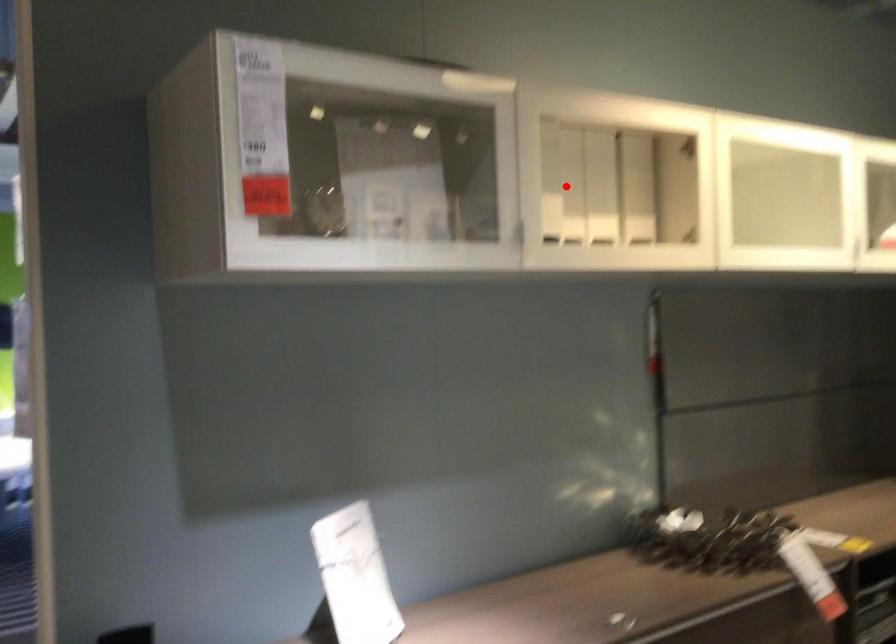
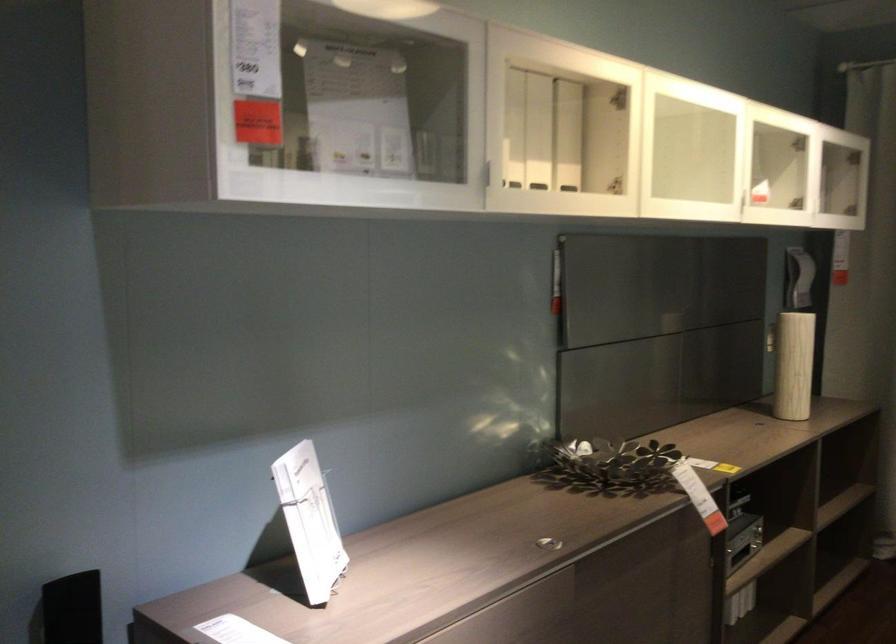
Find the pixel in the second image that matches the highlighted location in the first image.

(513, 128)